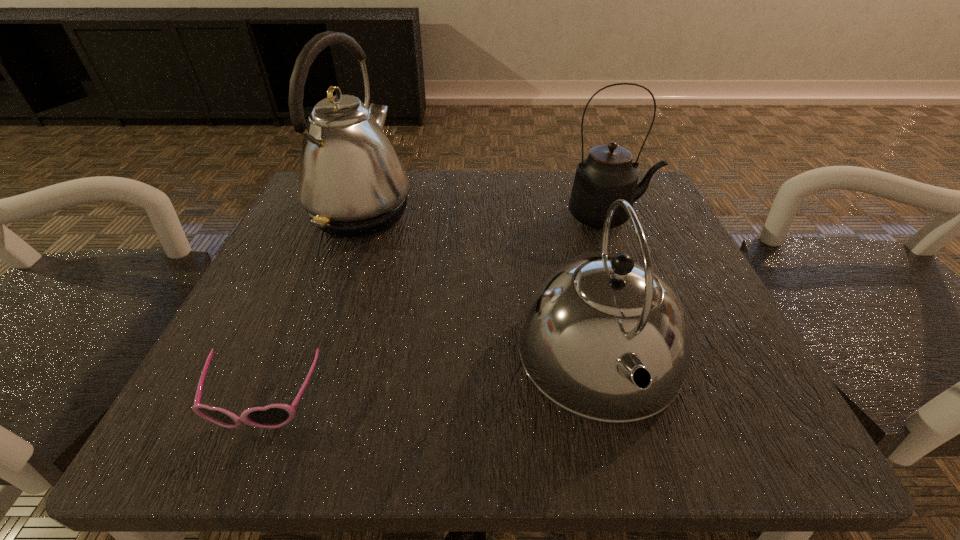
Locate an element on the screen. This screenshot has height=540, width=960. free point between the leftmost kettle and the shortest object is located at coordinates (312, 307).

You are a GUI agent. You are given a task and a screenshot of the screen. Output one action in this format:
    pyautogui.click(x=<x>, y=<y>)
    Task: Click on the vacant area between the nearest kettle and the sunglasses
    Image resolution: width=960 pixels, height=540 pixels.
    Given the screenshot: What is the action you would take?
    pyautogui.click(x=432, y=379)

Find the location of a particular element. object that is the second closest one to the tallest kettle is located at coordinates (272, 416).

This screenshot has width=960, height=540. What are the coordinates of `object identified as the closest to the leftmost kettle` in the screenshot? It's located at (605, 338).

Identify which kettle is the closest to the nearest kettle. Please provide its 2D coordinates. Your answer should be formatted as a tuple, i.e. [(x, y)], where the tuple contains the x and y coordinates of a point satisfying the conditions above.

[(608, 174)]

Point out which kettle is positioned as the nearest to the nearest kettle. Please provide its 2D coordinates. Your answer should be formatted as a tuple, i.e. [(x, y)], where the tuple contains the x and y coordinates of a point satisfying the conditions above.

[(608, 174)]